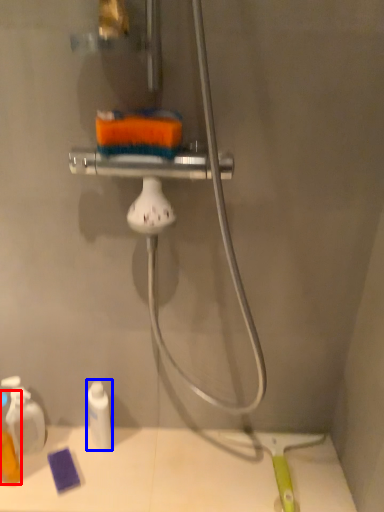
Question: Which of the following is the closest to the observer, toiletry (highlighted by a red box) or toiletry (highlighted by a blue box)?

Choices:
 (A) toiletry
 (B) toiletry

Answer: (A)